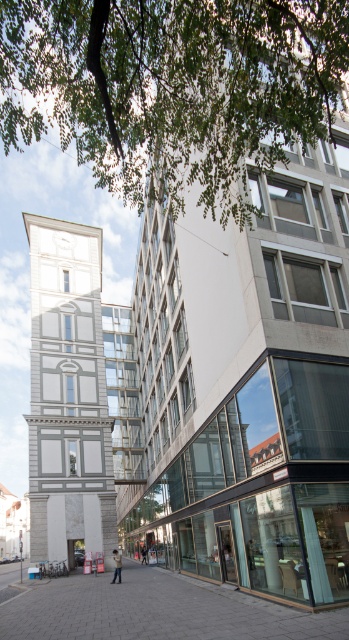
You are standing on the paved stone sidewalk at center and want to pick up the light brown leather jacket at center. Can you reach it without stepping off the sidewalk?

The paved stone sidewalk at center is in front of the light brown leather jacket at center, so you can reach it without leaving the sidewalk.

You are a delivery person standing on the paved stone sidewalk at center and need to place a light brown leather jacket at center. Can you reach the jacket without leaving the sidewalk?

The paved stone sidewalk at center and light brown leather jacket at center are 7.54 meters apart from each other. Since the jacket is 7.54 meters away from the sidewalk, you would need to leave the sidewalk to reach it.